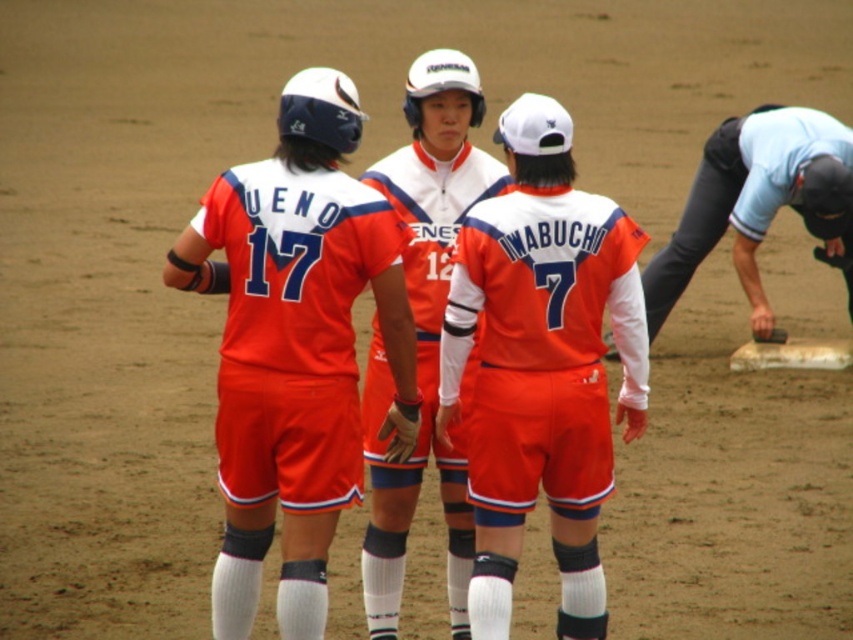
You are a photographer standing behind the players and want to take a photo that includes both the orange matte jersey at center and the orange uniformed players at center. Which object will appear larger in the photo?

The orange matte jersey at center will appear larger in the photo because it is much taller than the orange uniformed players at center.

You are a photographer trying to capture the best angle of the softball game. You notice two points in the image labeled as point (558,358) and point (409,509). Which point is nearer to your camera?

Point (558,358) is closer to the viewer than point (409,509).